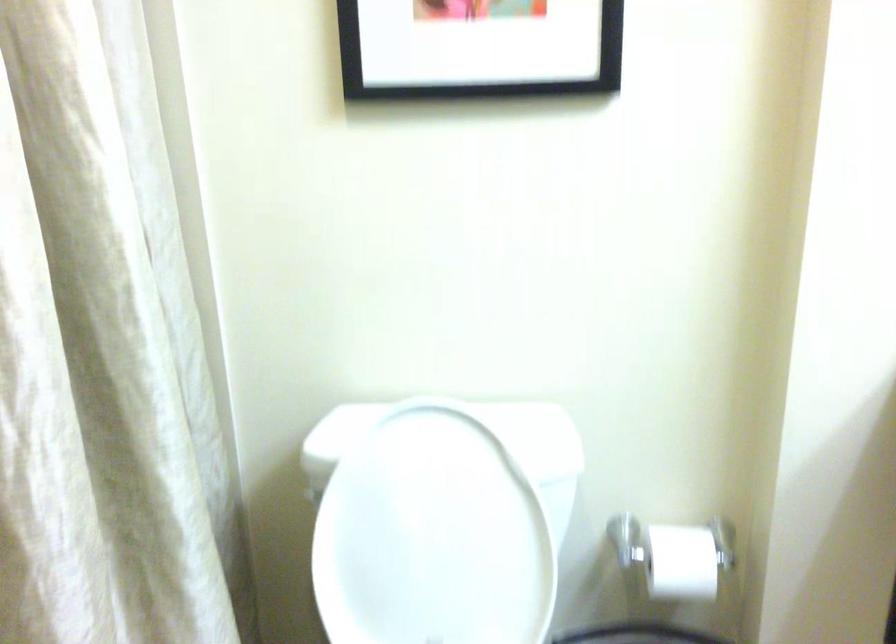
Locate an element on the screen. The width and height of the screenshot is (896, 644). white toilet lid is located at coordinates (440, 520).